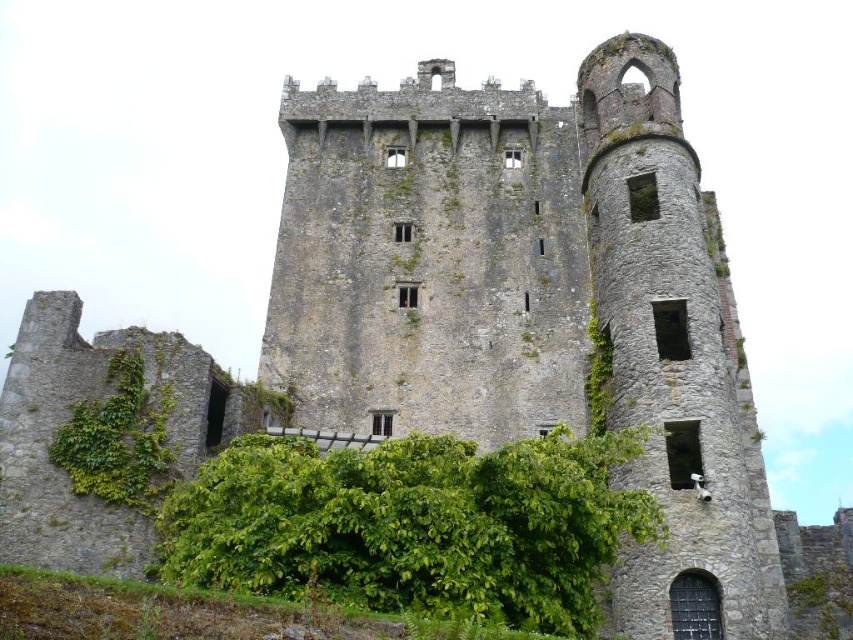
Question: Where is green leafy bush at lower center located in relation to green leafy ivy at lower left in the image?

Choices:
 (A) right
 (B) left

Answer: (A)

Question: Which point appears farthest from the camera in this image?

Choices:
 (A) (108, 394)
 (B) (363, 584)

Answer: (A)

Question: Which object is farther from the camera taking this photo?

Choices:
 (A) green leafy bush at lower center
 (B) green leafy ivy at lower left

Answer: (B)

Question: Can you confirm if green leafy bush at lower center is thinner than green leafy ivy at lower left?

Choices:
 (A) no
 (B) yes

Answer: (A)

Question: Is green leafy bush at lower center closer to camera compared to green leafy ivy at lower left?

Choices:
 (A) yes
 (B) no

Answer: (A)